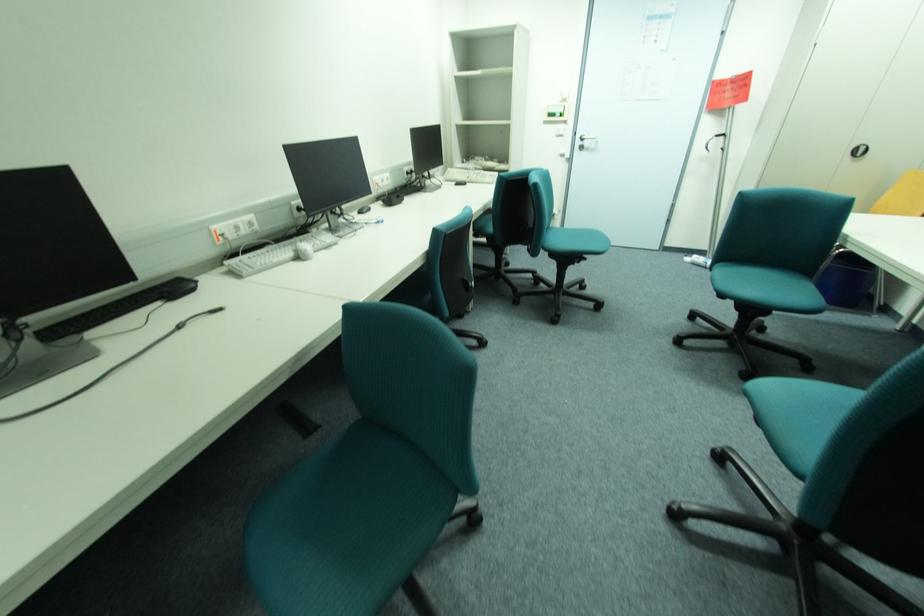
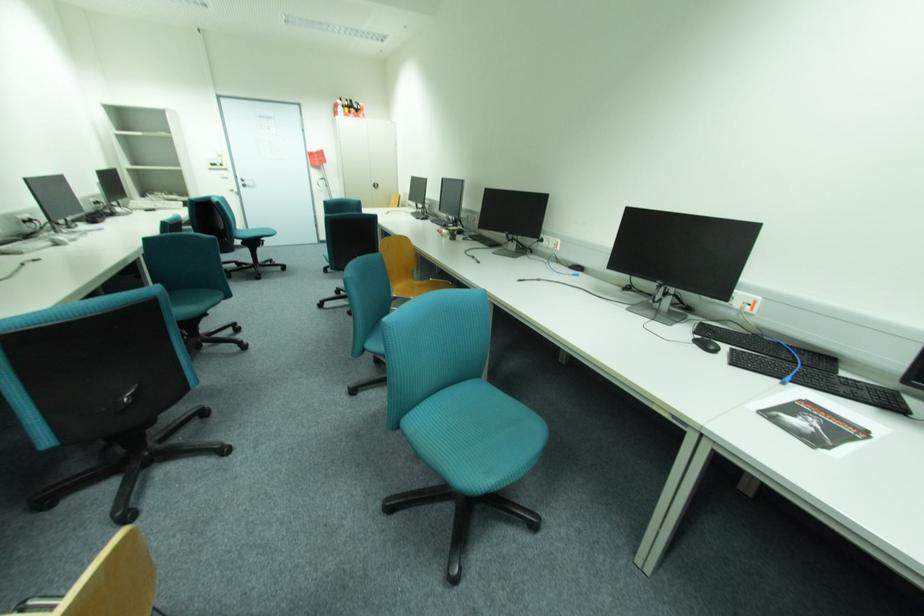
Find the pixel in the second image that matches point 592,144 in the first image.

(253, 183)